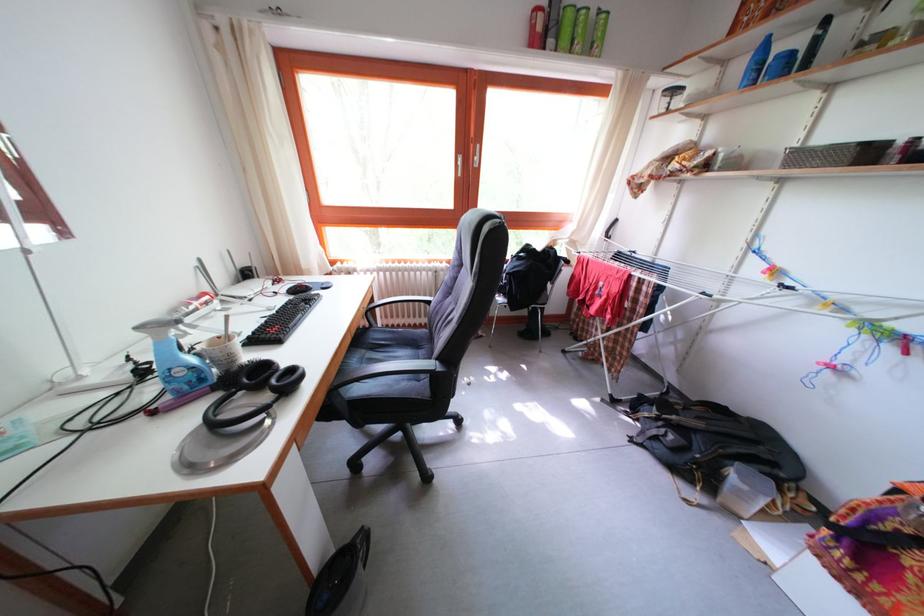
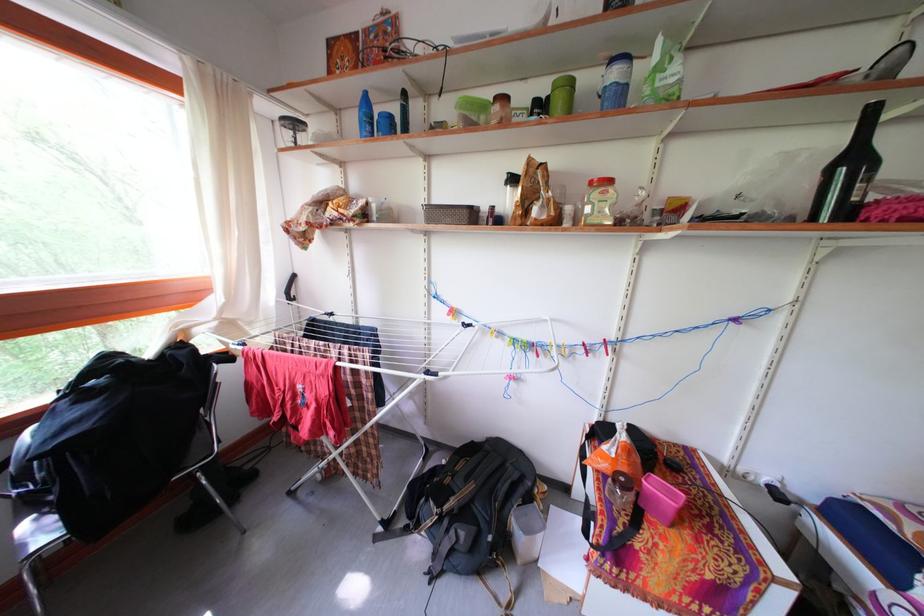
The point at (748, 74) is marked in the first image. Where is the corresponding point in the second image?

(360, 126)